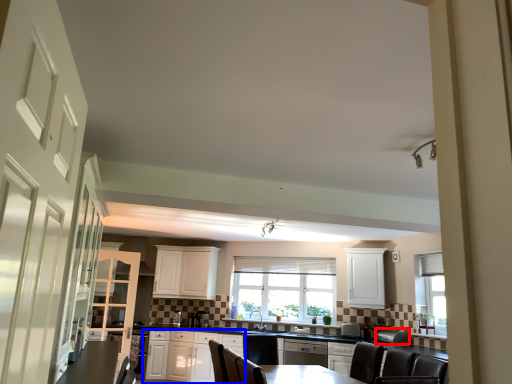
Question: Which object appears farthest to the camera in this image, appliance (highlighted by a red box) or cabinetry (highlighted by a blue box)?

Choices:
 (A) appliance
 (B) cabinetry

Answer: (B)